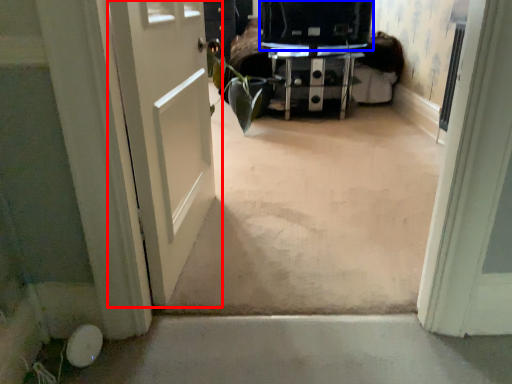
Question: Which of the following is the closest to the observer, door (highlighted by a red box) or back (highlighted by a blue box)?

Choices:
 (A) door
 (B) back

Answer: (A)